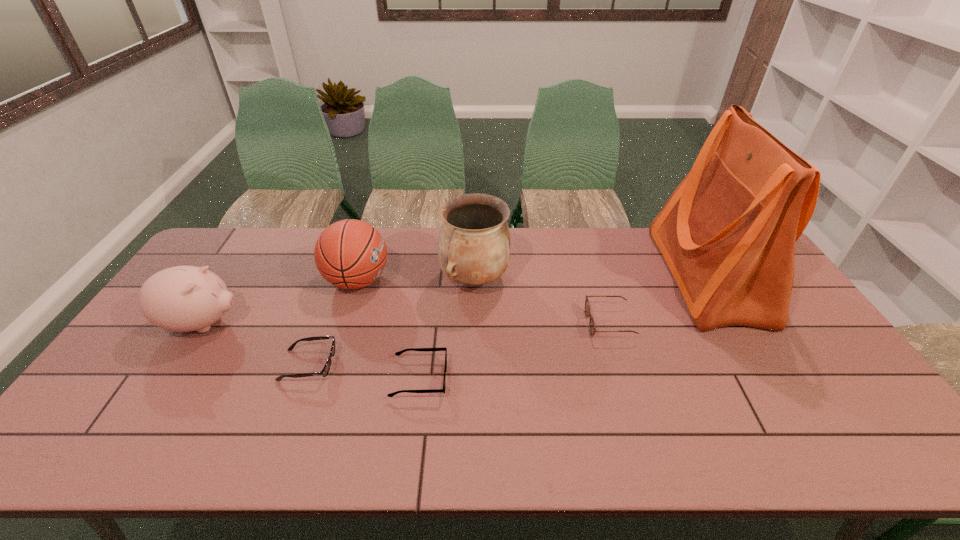
This screenshot has width=960, height=540. Find the location of `unoccupied position between the piggy bank and the basketball`. unoccupied position between the piggy bank and the basketball is located at coordinates (280, 302).

Where is `empty space between the farthest spectacles and the basketball`? The height and width of the screenshot is (540, 960). empty space between the farthest spectacles and the basketball is located at coordinates (483, 302).

This screenshot has height=540, width=960. In order to click on free space between the second spectacles from left to right and the leftmost spectacles in this screenshot , I will do `click(364, 372)`.

Locate an element on the screen. The image size is (960, 540). free space between the rightmost spectacles and the leftmost object is located at coordinates (406, 323).

Where is `vacant space that's between the sixth shortest object and the second spectacles from right to left`? This screenshot has width=960, height=540. vacant space that's between the sixth shortest object and the second spectacles from right to left is located at coordinates (446, 329).

This screenshot has width=960, height=540. I want to click on free space between the leftmost spectacles and the shopping bag, so click(508, 321).

The width and height of the screenshot is (960, 540). I want to click on free space between the leftmost spectacles and the leftmost object, so click(x=255, y=344).

This screenshot has height=540, width=960. I want to click on unoccupied area between the tallest object and the sixth object from left to right, so (x=658, y=300).

Locate an element on the screen. free spot between the leftmost spectacles and the farthest spectacles is located at coordinates (459, 345).

At what (x,y) coordinates should I click in order to perform the action: click on empty location between the second spectacles from left to right and the leftmost spectacles. Please return your answer as a coordinate pair (x, y). Looking at the image, I should click on click(x=364, y=372).